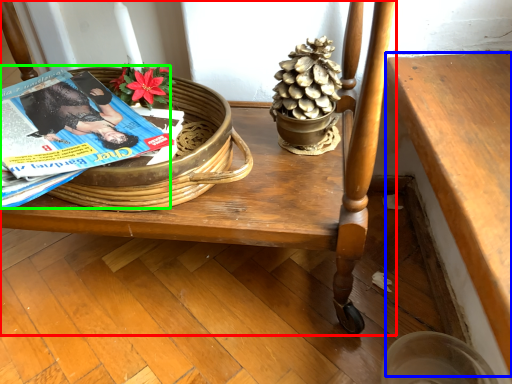
Question: Which object is positioned closest to furniture (highlighted by a red box)? Select from table (highlighted by a blue box) and magazine (highlighted by a green box).

Choices:
 (A) table
 (B) magazine

Answer: (A)